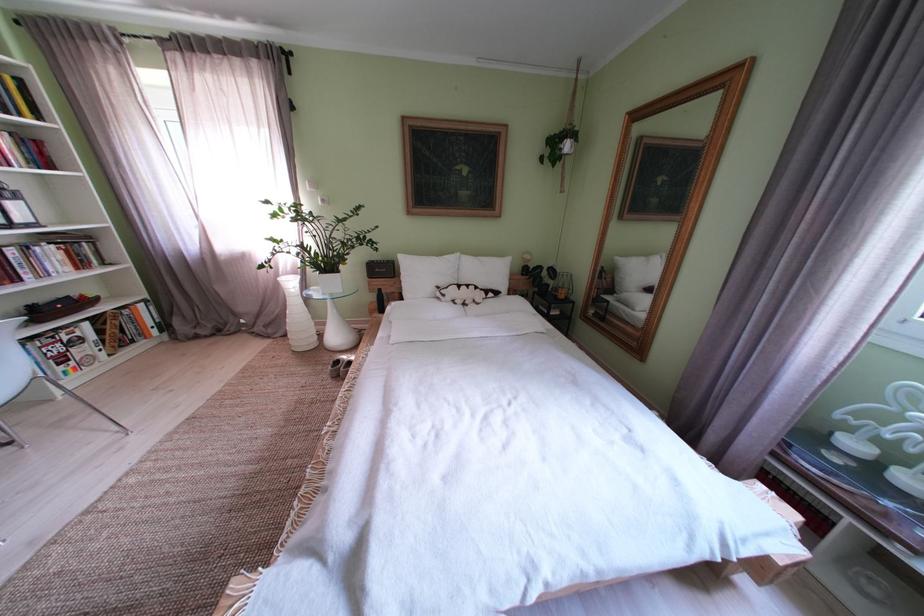
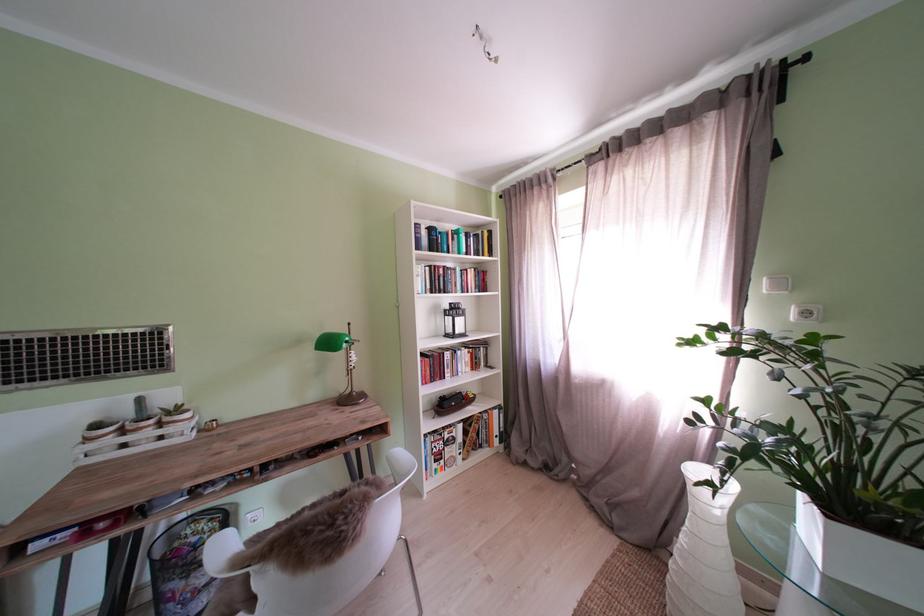
Locate, in the second image, the point that corresponds to the point at 27,285 in the first image.

(454, 382)